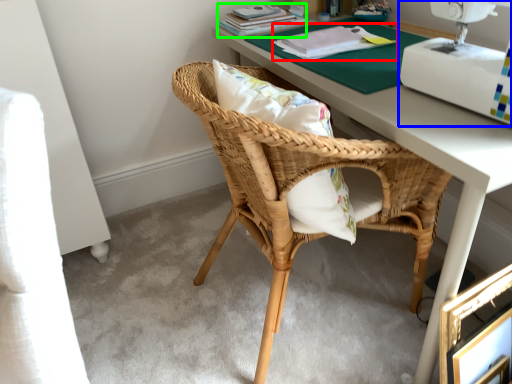
Question: Which object is positioned farthest from book (highlighted by a red box)? Select from sewing machine (highlighted by a blue box) and book (highlighted by a green box).

Choices:
 (A) sewing machine
 (B) book

Answer: (A)